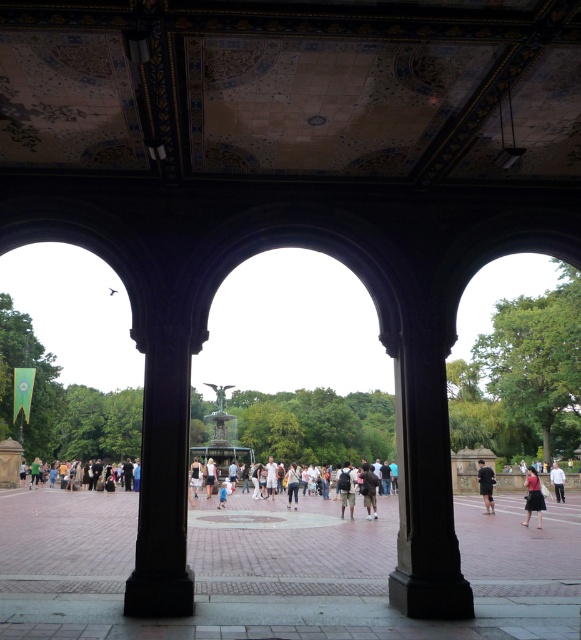
You are standing in the park and notice a dark brown leather backpack at center and light blue jeans at center. Which object is positioned higher from the ground?

The dark brown leather backpack at center is located above the light blue jeans at center, so it is positioned higher from the ground.

You are a photographer standing at the entrance of the arches. You want to take a photo that includes both the white cotton shirt at lower right and the light blue denim jeans at center. Which object should you focus on first to ensure both are in the frame?

You should focus on the white cotton shirt at lower right first because it is much taller than the light blue denim jeans at center, so adjusting the camera angle to accommodate its height will ensure both are captured in the frame.

You are a photographer standing at the entrance of the arches. You notice a dark gray backpack at center and a light blue denim jeans at center in the park. Which object is closer to your camera lens?

The dark gray backpack at center is closer to your camera lens because it is in front of the light blue denim jeans at center.